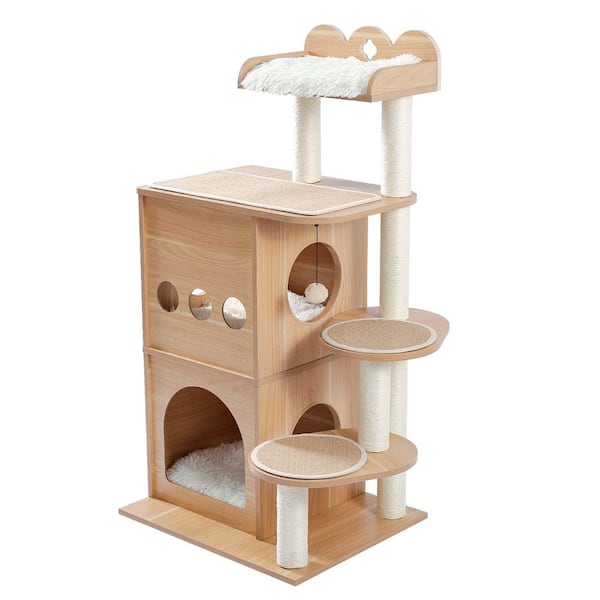
Locate an element on the screen. rectangular mat is located at coordinates (249, 182).